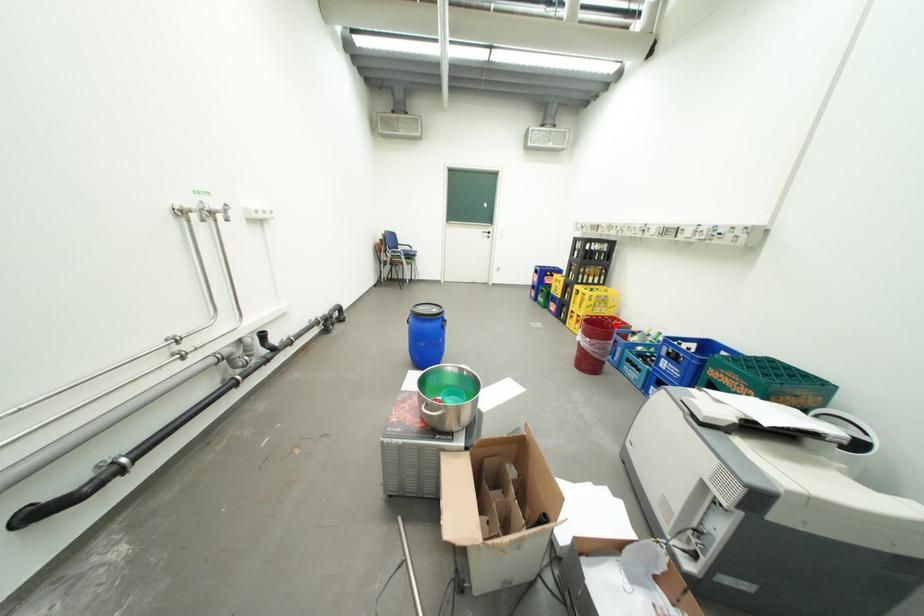
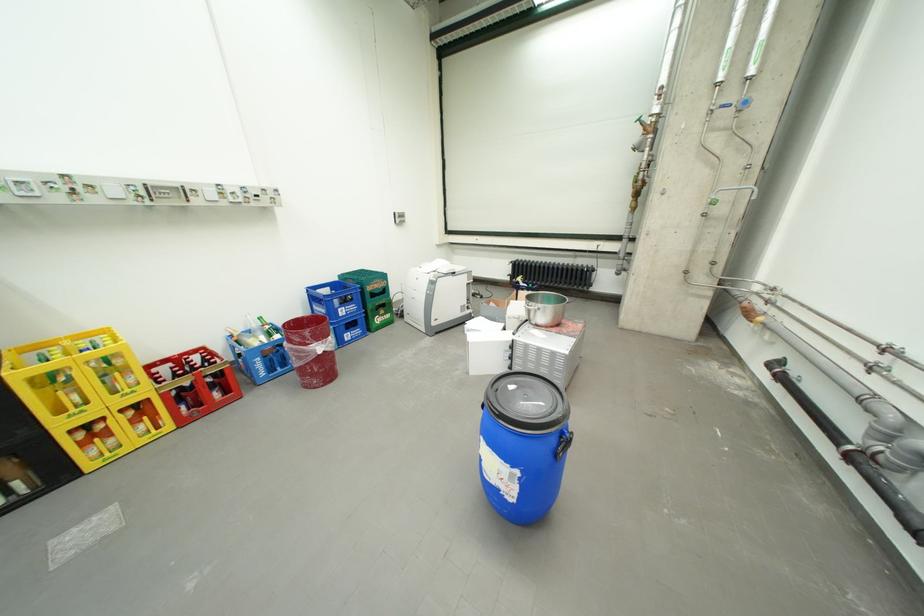
In the second image, find the point that corresponds to the highlighted location in the first image.

(297, 328)